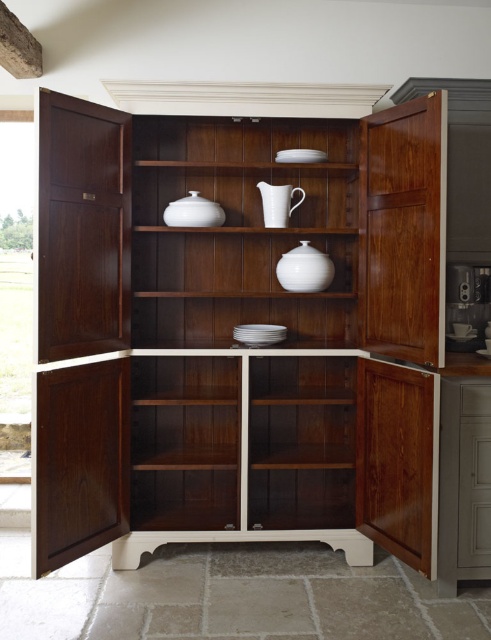
Question: Which of the following is the farthest from the observer?

Choices:
 (A) (3, 154)
 (B) (285, 209)
 (C) (136, 276)
 (D) (163, 166)

Answer: (A)

Question: Can you confirm if white glossy pitcher at center is thinner than white ceramic pitcher at center?

Choices:
 (A) yes
 (B) no

Answer: (B)

Question: Can you confirm if transparent glass door at left is positioned below white ceramic pitcher at center?

Choices:
 (A) no
 (B) yes

Answer: (A)

Question: Which point is farther from the camera taking this photo?

Choices:
 (A) (276, 205)
 (B) (28, 314)

Answer: (B)

Question: Considering the relative positions of white glossy vase at center and white ceramic pitcher at center in the image provided, where is white glossy vase at center located with respect to white ceramic pitcher at center?

Choices:
 (A) right
 (B) left

Answer: (B)

Question: Which of these objects is positioned farthest from the transparent glass door at left?

Choices:
 (A) white glossy pitcher at center
 (B) white ceramic pitcher at center

Answer: (B)